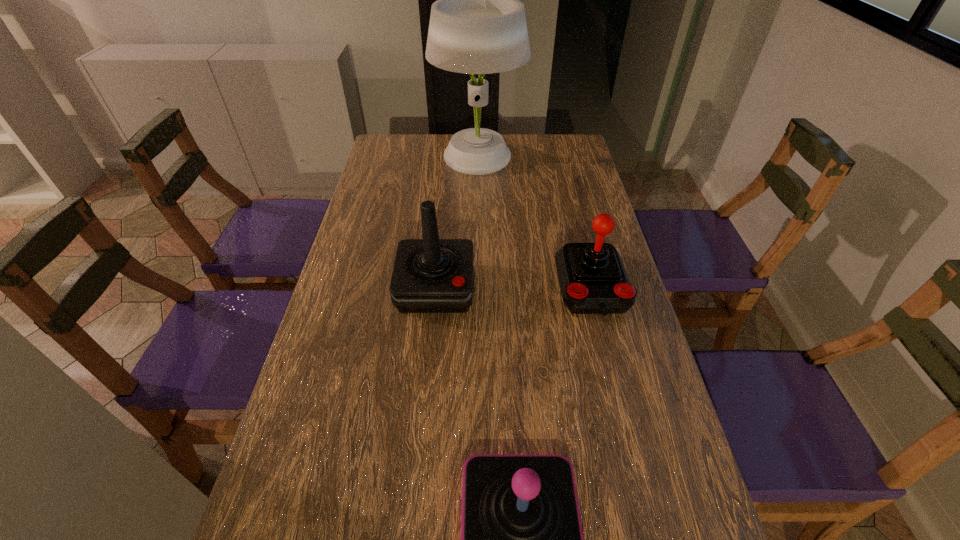
The image size is (960, 540). What are the coordinates of `vacant space at the far edge` in the screenshot? It's located at (540, 152).

What are the coordinates of `vacant space at the left edge of the desktop` in the screenshot? It's located at (342, 414).

Locate an element on the screen. blank space at the right edge of the desktop is located at coordinates (675, 457).

At what (x,y) coordinates should I click in order to perform the action: click on vacant space at the far left corner of the desktop. Please return your answer as a coordinate pair (x, y). Looking at the image, I should click on (394, 161).

At what (x,y) coordinates should I click in order to perform the action: click on blank space at the far right corner. Please return your answer as a coordinate pair (x, y). Image resolution: width=960 pixels, height=540 pixels. Looking at the image, I should click on click(551, 163).

At what (x,y) coordinates should I click in order to perform the action: click on empty location between the third shortest object and the second shortest joystick. Please return your answer as a coordinate pair (x, y). The image size is (960, 540). Looking at the image, I should click on (514, 287).

Where is `blank region between the second tallest object and the second tallest joystick`? blank region between the second tallest object and the second tallest joystick is located at coordinates tap(514, 287).

The height and width of the screenshot is (540, 960). I want to click on free space between the tallest object and the third shortest object, so click(x=457, y=223).

Find the location of a particular element. This screenshot has height=540, width=960. free spot between the lamp and the rightmost joystick is located at coordinates (535, 223).

The height and width of the screenshot is (540, 960). I want to click on the third closest object relative to the farthest object, so click(521, 535).